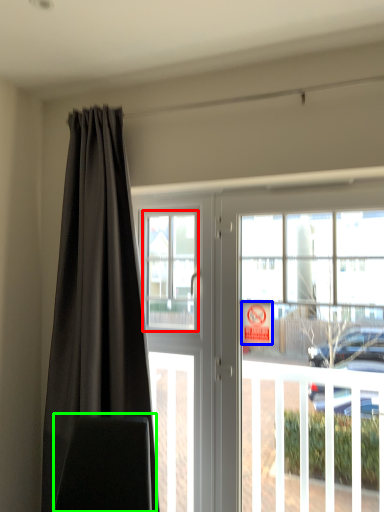
Question: Which object is the farthest from window screen (highlighted by a red box)? Choose among these: parking sign (highlighted by a blue box) or swivel chair (highlighted by a green box).

Choices:
 (A) parking sign
 (B) swivel chair

Answer: (B)